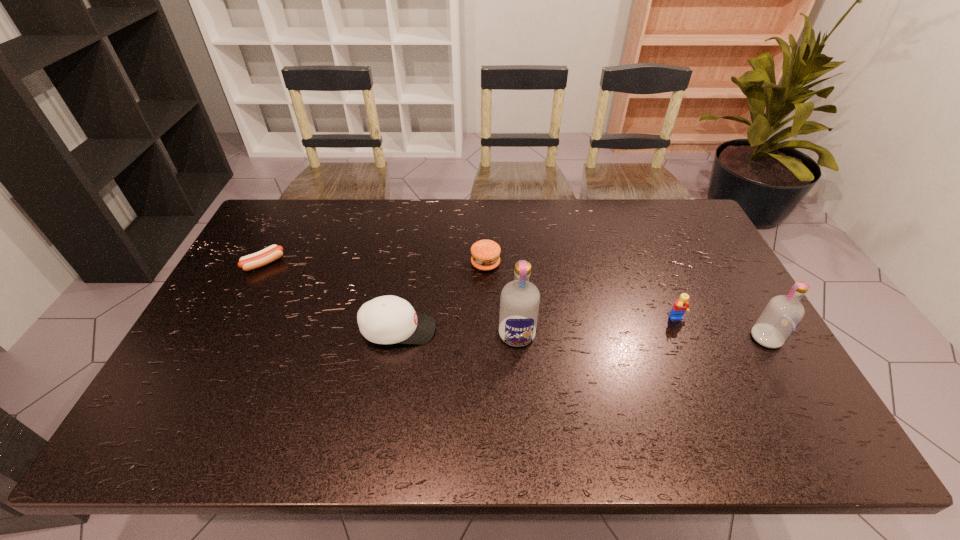
The width and height of the screenshot is (960, 540). I want to click on free space located on the back of the sausage, so click(x=278, y=235).

This screenshot has width=960, height=540. Identify the location of vacant space positioned on the back of the second shortest object. (485, 209).

What are the coordinates of `vacant space located on the front-facing side of the baseball cap` in the screenshot? It's located at (498, 330).

The height and width of the screenshot is (540, 960). I want to click on free space located 0.180m on the face of the second object from right to left, so click(703, 381).

Locate an element on the screen. object present at the left edge is located at coordinates (273, 252).

Find the location of a particular element. object present at the right edge is located at coordinates tap(783, 314).

In the image, there is a desktop. Where is `vacant space at the far edge`? vacant space at the far edge is located at coordinates (322, 222).

This screenshot has width=960, height=540. In the image, there is a desktop. Find the location of `vacant area at the near edge`. vacant area at the near edge is located at coordinates (627, 389).

Where is `vacant area at the right edge of the desktop`? Image resolution: width=960 pixels, height=540 pixels. vacant area at the right edge of the desktop is located at coordinates (704, 254).

In order to click on free region at the near left corner of the desktop in this screenshot , I will do `click(201, 399)`.